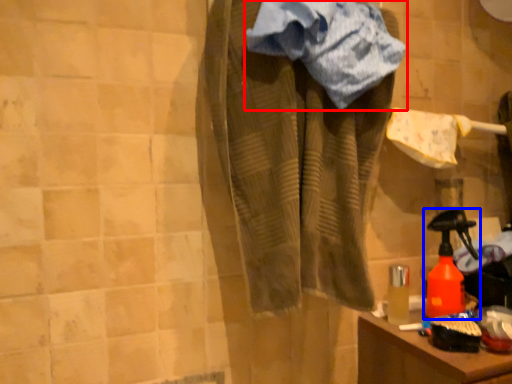
Question: Which object appears closest to the camera in this image, towel (highlighted by a red box) or bottle (highlighted by a blue box)?

Choices:
 (A) towel
 (B) bottle

Answer: (A)